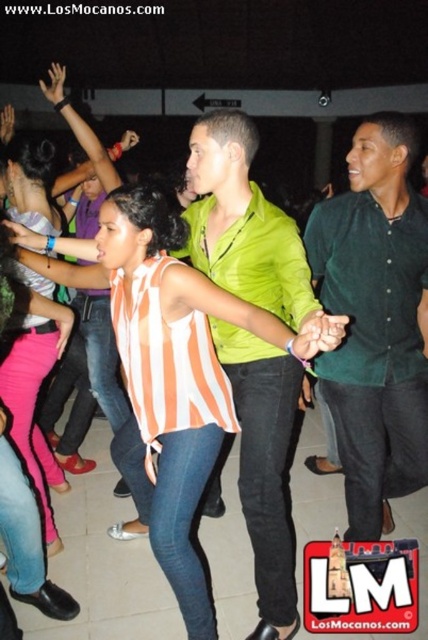
Is point (217, 172) farther from camera compared to point (70, 317)?

No, (217, 172) is closer to viewer.

Does green matte shirt at center appear under striped fabric shirt at center?

No, green matte shirt at center is not below striped fabric shirt at center.

Measure the distance between green matte shirt at center and camera.

green matte shirt at center and camera are 1.32 meters apart from each other.

This screenshot has height=640, width=428. What are the coordinates of `green matte shirt at center` in the screenshot? It's located at point(243,224).

Is orange striped shirt at center taller than green matte shirt at center?

No.

Who is positioned more to the right, orange striped shirt at center or green matte shirt at center?

green matte shirt at center

Find the location of `orange striped shirt at center`. orange striped shirt at center is located at coordinates (175, 380).

Find the location of a particular element. The width and height of the screenshot is (428, 640). orange striped shirt at center is located at coordinates (175, 380).

Who is lower down, dark green button-up shirt at center or striped fabric shirt at center?

striped fabric shirt at center is below.

Which is more to the left, dark green button-up shirt at center or striped fabric shirt at center?

From the viewer's perspective, striped fabric shirt at center appears more on the left side.

Is point (354, 230) farther from camera compared to point (17, 200)?

No, (354, 230) is in front of (17, 200).

Find the location of a particular element. This screenshot has width=428, height=640. dark green button-up shirt at center is located at coordinates (376, 321).